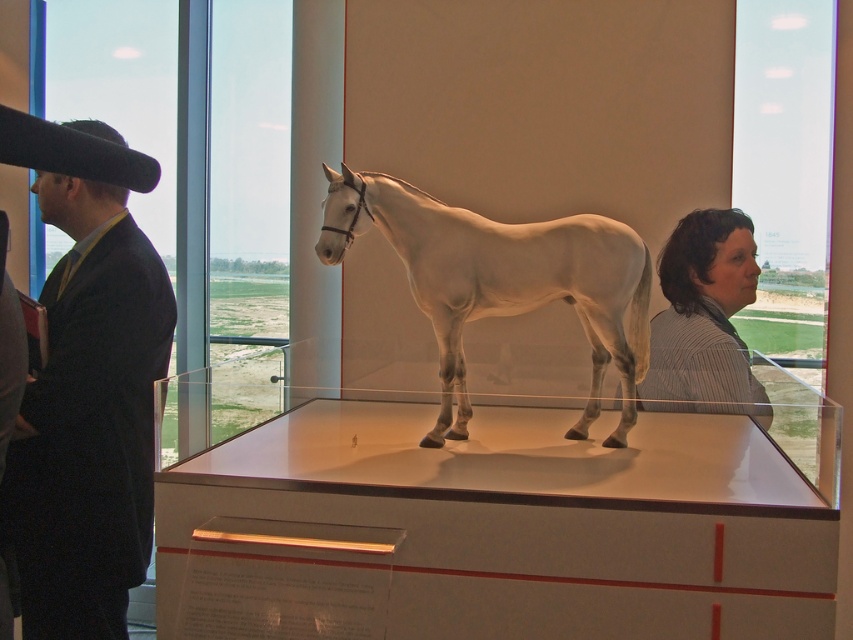
Is point (45, 216) farther from camera compared to point (541, 276)?

Yes, point (45, 216) is farther from viewer.

Between black suit at left and white glossy horse at center, which one is positioned lower?

Positioned lower is black suit at left.

Who is more forward, (73, 428) or (416, 244)?

Point (416, 244) is more forward.

Locate an element on the screen. This screenshot has width=853, height=640. black suit at left is located at coordinates (90, 419).

Who is lower down, black suit at left or striped fabric shirt at right?

black suit at left

Image resolution: width=853 pixels, height=640 pixels. I want to click on black suit at left, so click(90, 419).

Locate an element on the screen. black suit at left is located at coordinates (90, 419).

Describe the element at coordinates (502, 282) in the screenshot. This screenshot has height=640, width=853. I see `white glossy horse at center` at that location.

Locate an element on the screen. This screenshot has width=853, height=640. white glossy horse at center is located at coordinates (502, 282).

Is point (479, 301) more distant than point (686, 307)?

No, (479, 301) is closer to viewer.

This screenshot has width=853, height=640. What are the coordinates of `white glossy horse at center` in the screenshot? It's located at (502, 282).